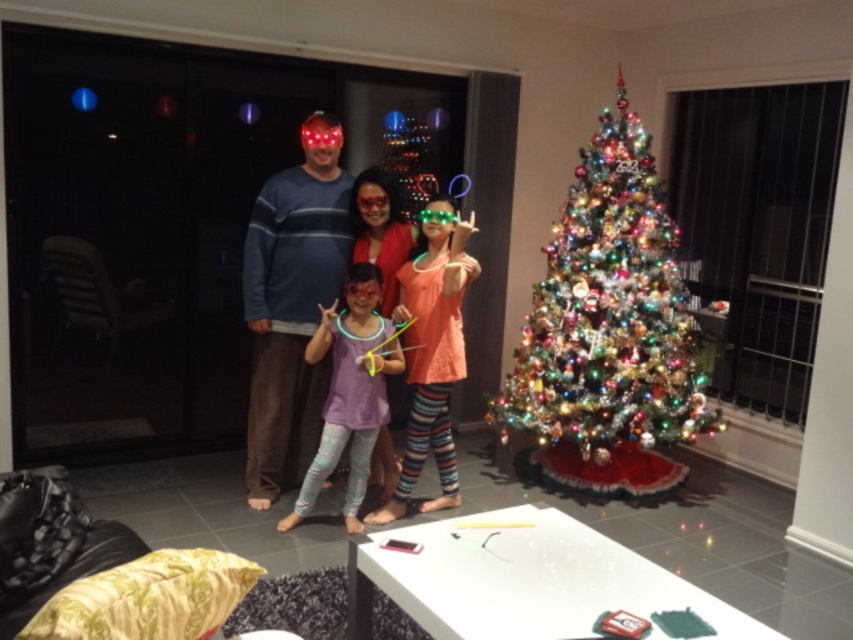
You are standing at the point marked as point (608, 314) in the image. Looking around, you see a shiny metallic Christmas tree at right. What is the nearest object to you in this festive scene?

The nearest object to you at point (608, 314) is the shiny metallic Christmas tree at right because it is located to your right side and is part of the central festive display.

You are standing in the living room where the shiny metallic Christmas tree at right and the purple matte leggings at center are visible. Which object is closer to you?

The shiny metallic Christmas tree at right is closer to you because it is further to the viewer than the purple matte leggings at center.

You are a photographer setting up for a group photo. You want to ensure that the neon plastic glasses at center and the purple matte leggings at center are both visible in the shot. Based on their positions, which object should be closer to the camera to avoid being blocked?

The neon plastic glasses at center should be closer to the camera because the purple matte leggings at center is behind it, so moving the glasses forward would prevent the leggings from blocking them.